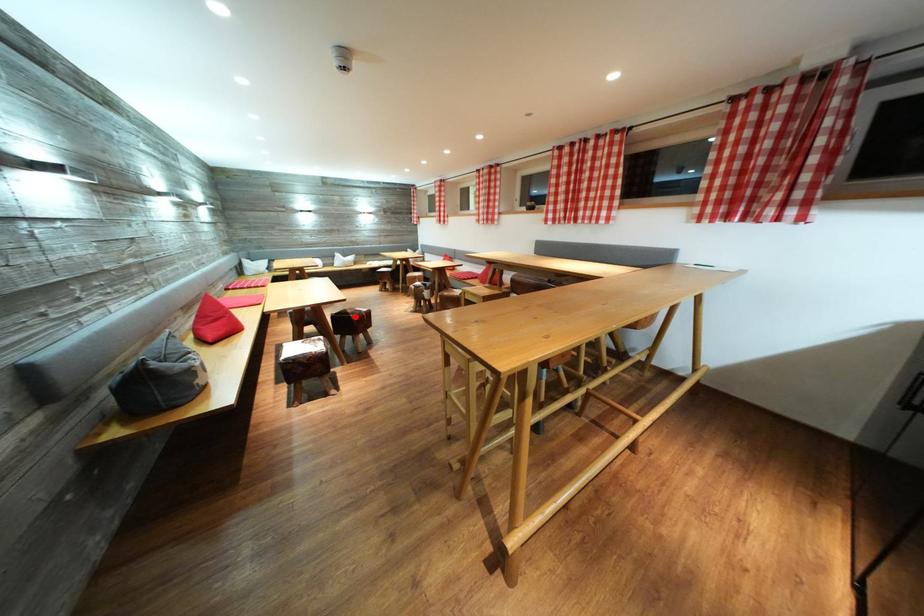
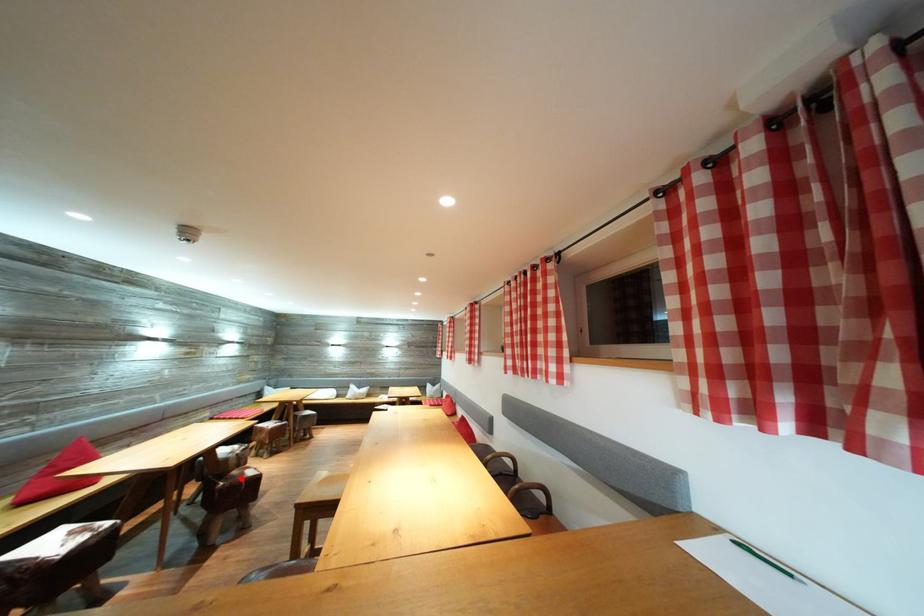
I am providing you with two images of the same scene from different viewpoints. A red point is marked on the first image and another point is marked on the second image. Do the highlighted points in image1 and image2 indicate the same real-world spot?

Yes